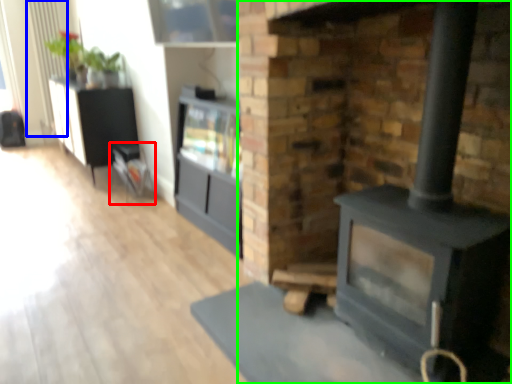
Question: Estimate the real-world distances between objects in this image. Which object is farther from furniture (highlighted by a red box), radiator (highlighted by a blue box) or fireplace (highlighted by a green box)?

Choices:
 (A) radiator
 (B) fireplace

Answer: (A)